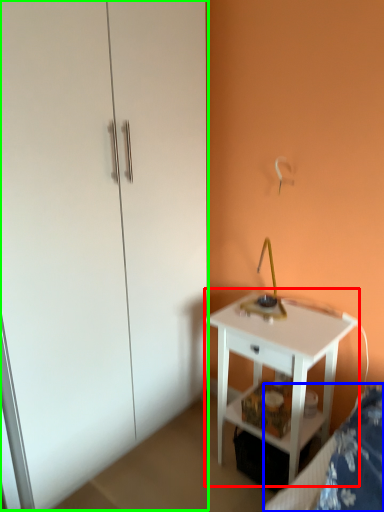
Question: Considering the real-world distances, which object is farthest from nightstand (highlighted by a red box)? bed frame (highlighted by a blue box) or dresser (highlighted by a green box)?

Choices:
 (A) bed frame
 (B) dresser

Answer: (B)